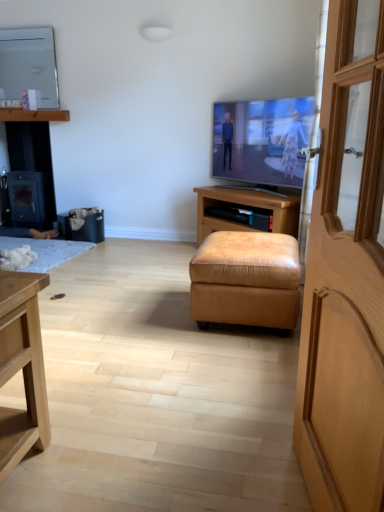
Question: From the image's perspective, is black leather trash bin/can at lower left under black matte wood fireplace at left?

Choices:
 (A) yes
 (B) no

Answer: (A)

Question: From a real-world perspective, does black leather trash bin/can at lower left stand above black matte wood fireplace at left?

Choices:
 (A) yes
 (B) no

Answer: (B)

Question: Is black matte wood fireplace at left completely or partially inside black leather trash bin/can at lower left?

Choices:
 (A) no
 (B) yes

Answer: (A)

Question: Does black leather trash bin/can at lower left appear on the right side of black matte wood fireplace at left?

Choices:
 (A) yes
 (B) no

Answer: (A)

Question: Is black leather trash bin/can at lower left beside black matte wood fireplace at left?

Choices:
 (A) yes
 (B) no

Answer: (B)

Question: From a real-world perspective, is white fluffy rug at lower left positioned above or below wooden door at right?

Choices:
 (A) below
 (B) above

Answer: (A)

Question: Considering their positions, is white fluffy rug at lower left located in front of or behind wooden door at right?

Choices:
 (A) behind
 (B) front

Answer: (A)

Question: Considering the positions of white fluffy rug at lower left and wooden door at right in the image, is white fluffy rug at lower left bigger or smaller than wooden door at right?

Choices:
 (A) small
 (B) big

Answer: (A)

Question: Does point (34, 242) appear closer or farther from the camera than point (344, 297)?

Choices:
 (A) farther
 (B) closer

Answer: (A)

Question: Does point (102, 221) appear closer or farther from the camera than point (66, 258)?

Choices:
 (A) farther
 (B) closer

Answer: (A)

Question: From a real-world perspective, is black leather trash bin/can at lower left physically located above or below white fluffy rug at lower left?

Choices:
 (A) below
 (B) above

Answer: (B)

Question: Is black leather trash bin/can at lower left spatially inside white fluffy rug at lower left, or outside of it?

Choices:
 (A) inside
 (B) outside

Answer: (B)

Question: From their relative heights in the image, would you say black leather trash bin/can at lower left is taller or shorter than white fluffy rug at lower left?

Choices:
 (A) short
 (B) tall

Answer: (B)

Question: In terms of size, does white fluffy rug at lower left appear bigger or smaller than flat screen tv at center, which is counted as the 1th television, starting from the front?

Choices:
 (A) small
 (B) big

Answer: (A)

Question: In the image, is white fluffy rug at lower left positioned in front of or behind flat screen tv at center, marked as the 2th television in a top-to-bottom arrangement?

Choices:
 (A) front
 (B) behind

Answer: (B)